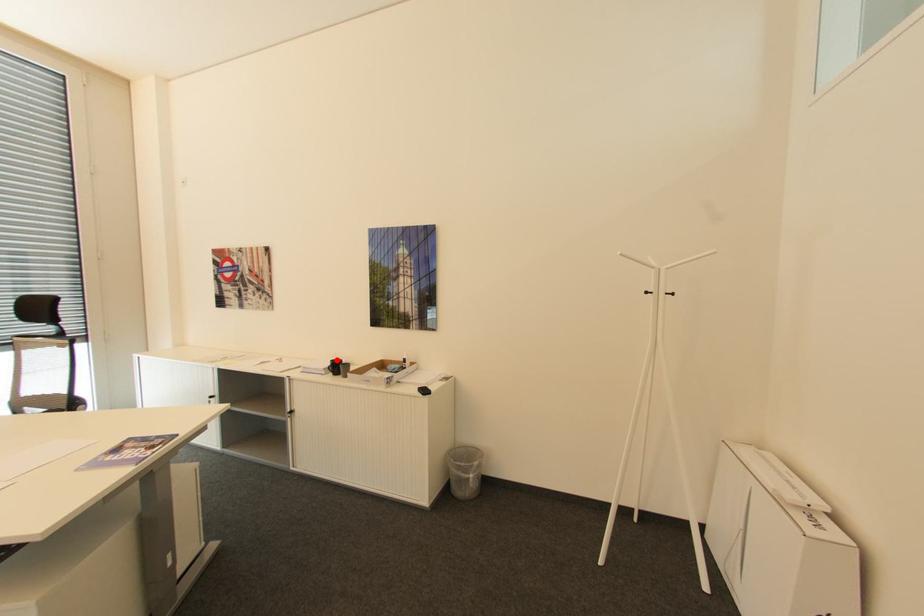
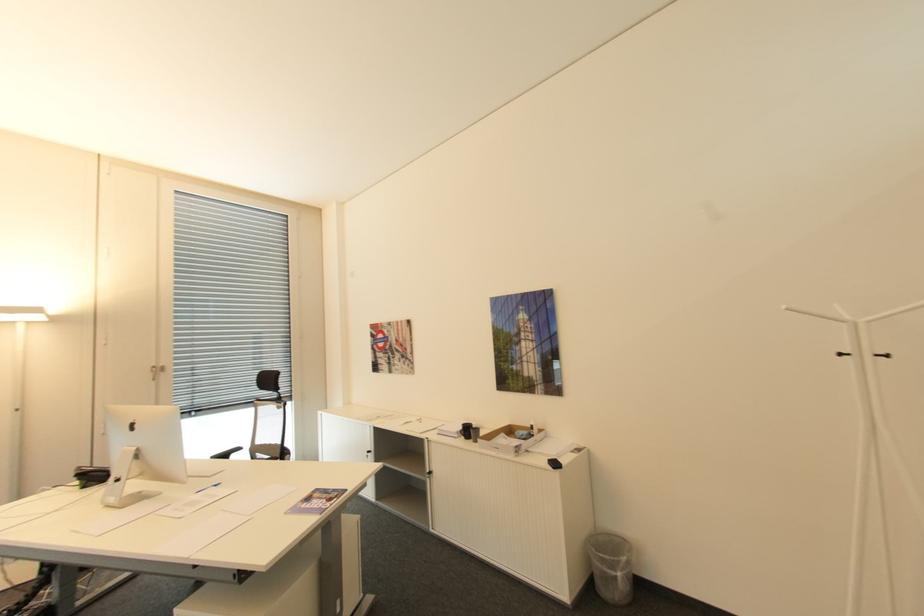
In the second image, find the point that corresponds to the highlighted location in the first image.

(468, 424)